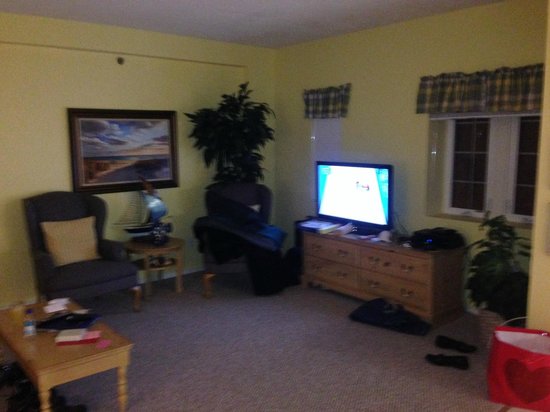
This screenshot has height=412, width=550. What are the coordinates of `dresser` in the screenshot? It's located at (339, 261).